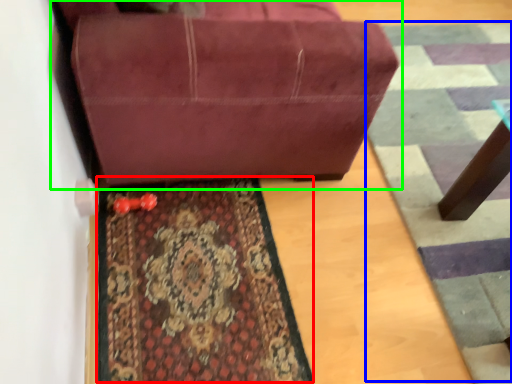
Question: Considering the real-world distances, which object is closest to mat (highlighted by a red box)? doormat (highlighted by a blue box) or studio couch (highlighted by a green box).

Choices:
 (A) doormat
 (B) studio couch

Answer: (B)